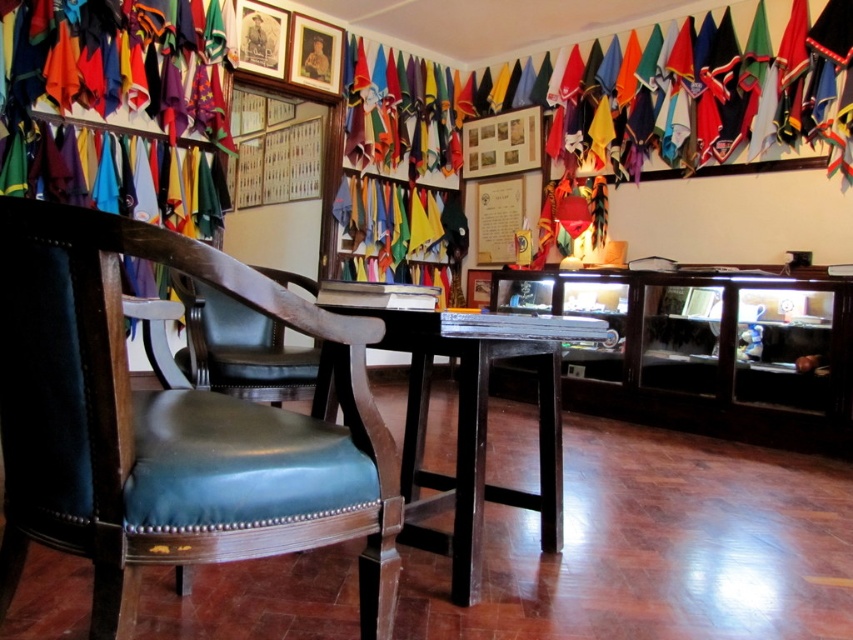
Question: Which of the following is the closest to the observer?

Choices:
 (A) leather at left
 (B) dark wood table at center

Answer: (A)

Question: Is leather at left positioned before leather at center?

Choices:
 (A) no
 (B) yes

Answer: (B)

Question: Which point is farther from the camera taking this photo?

Choices:
 (A) (x=228, y=260)
 (B) (x=492, y=355)
 (C) (x=260, y=380)

Answer: (C)

Question: Can you confirm if leather at left is positioned above leather at center?

Choices:
 (A) no
 (B) yes

Answer: (A)

Question: Does leather at left have a greater width compared to leather at center?

Choices:
 (A) yes
 (B) no

Answer: (A)

Question: Which point is farther from the camera taking this photo?

Choices:
 (A) (276, 483)
 (B) (282, 269)
 (C) (502, 323)

Answer: (B)